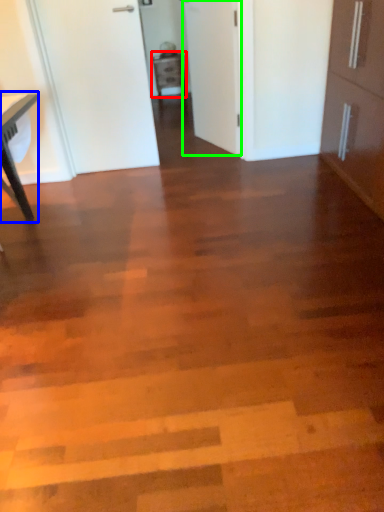
Question: Which object is positioned closest to cabinetry (highlighted by a red box)? Select from table (highlighted by a blue box) and door (highlighted by a green box).

Choices:
 (A) table
 (B) door

Answer: (B)